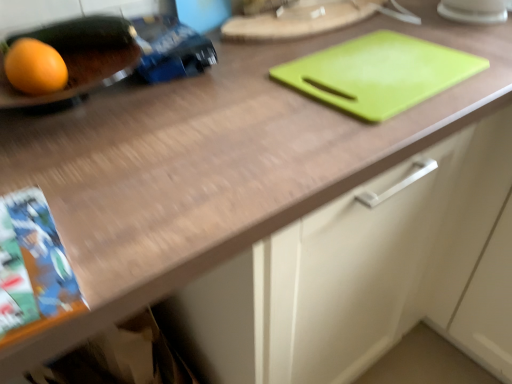
Question: Considering their positions, is orange matte grapefruit at left located in front of or behind green plastic cutting board at upper right, which appears as the first tray when viewed from the right?

Choices:
 (A) behind
 (B) front

Answer: (B)

Question: Considering the positions of orange matte grapefruit at left and green plastic cutting board at upper right, which appears as the first tray when viewed from the right, in the image, is orange matte grapefruit at left wider or thinner than green plastic cutting board at upper right, which appears as the first tray when viewed from the right,?

Choices:
 (A) thin
 (B) wide

Answer: (A)

Question: Based on their relative distances, which object is farther from the green plastic cutting board at upper right, which appears as the first tray when viewed from the right?

Choices:
 (A) matte black tray at left, the 3th tray when ordered from right to left
 (B) green plastic cutting board at upper center, which appears as the 2th tray when viewed from the right
 (C) orange matte grapefruit at left

Answer: (C)

Question: Which object is the farthest from the green plastic cutting board at upper right, which appears as the first tray when viewed from the right?

Choices:
 (A) orange matte grapefruit at left
 (B) matte black tray at left, arranged as the first tray when viewed from the left
 (C) green plastic cutting board at upper center, which appears as the 2th tray when viewed from the right

Answer: (A)